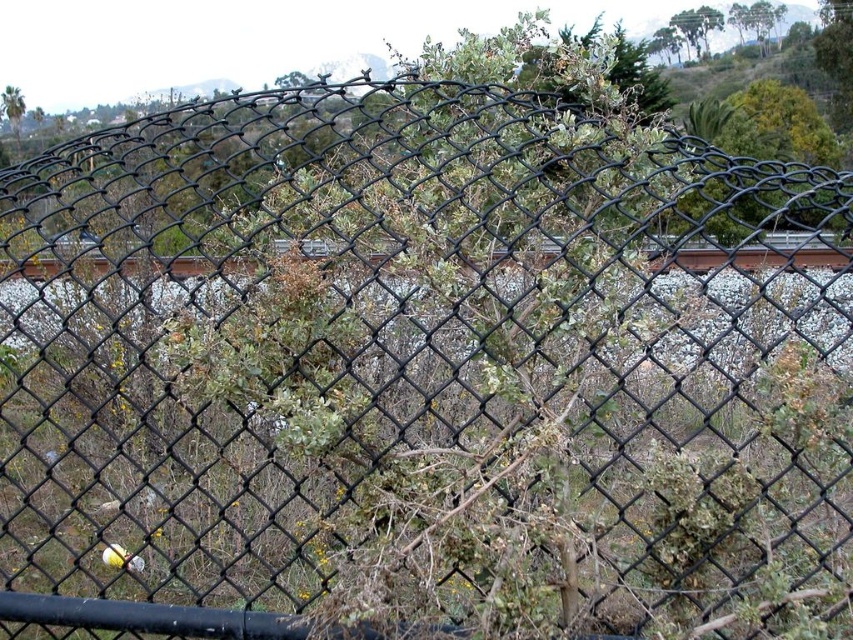
Question: Among these objects, which one is farthest from the camera?

Choices:
 (A) brown wooden train track at center
 (B) green leafy tree at upper left

Answer: (B)

Question: Is brown wooden train track at center behind green leafy tree at upper left?

Choices:
 (A) no
 (B) yes

Answer: (A)

Question: Considering the relative positions of brown wooden train track at center and green leafy tree at upper left in the image provided, where is brown wooden train track at center located with respect to green leafy tree at upper left?

Choices:
 (A) below
 (B) above

Answer: (A)

Question: Is brown wooden train track at center positioned at the back of green leafy tree at upper left?

Choices:
 (A) no
 (B) yes

Answer: (A)

Question: Which point is closer to the camera?

Choices:
 (A) (780, 259)
 (B) (16, 108)

Answer: (A)